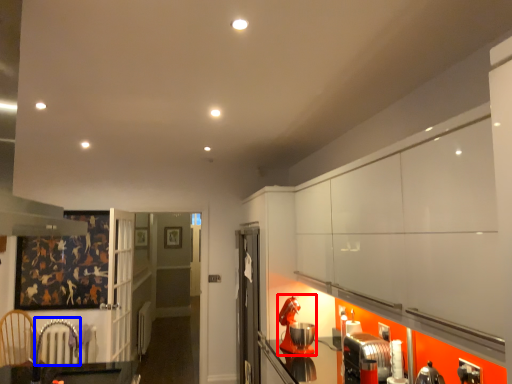
Question: Which of the following is the closest to the observer, appliance (highlighted by a red box) or armchair (highlighted by a blue box)?

Choices:
 (A) appliance
 (B) armchair

Answer: (B)